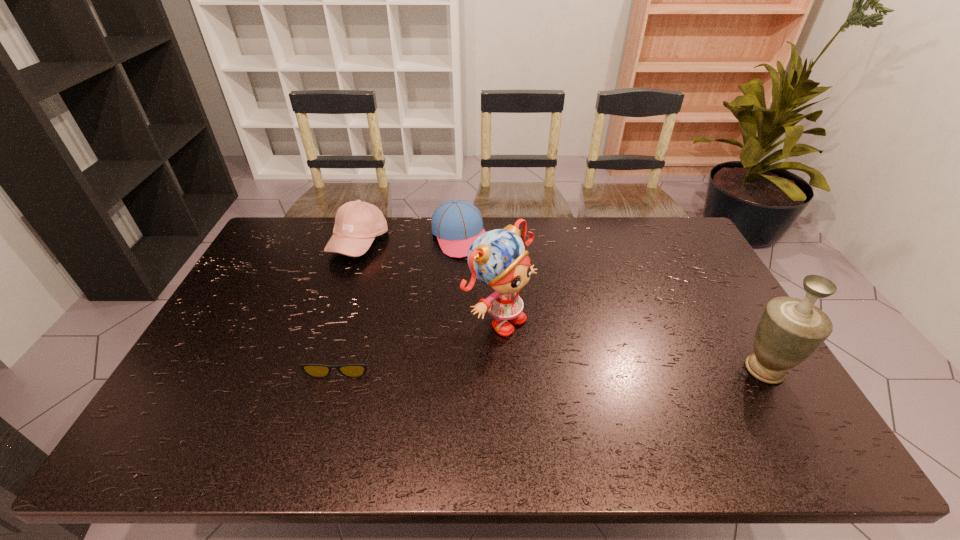
In the image, there is a desktop. Where is `vacant space at the far edge`? The image size is (960, 540). vacant space at the far edge is located at coordinates [551, 224].

Where is `free location at the near edge`? The image size is (960, 540). free location at the near edge is located at coordinates (401, 393).

What are the coordinates of `free space at the left edge of the desktop` in the screenshot? It's located at (259, 298).

Find the location of a particular element. The width and height of the screenshot is (960, 540). vacant space at the right edge of the desktop is located at coordinates (700, 297).

The height and width of the screenshot is (540, 960). In the image, there is a desktop. Find the location of `vacant space at the far left corner`. vacant space at the far left corner is located at coordinates (287, 230).

Image resolution: width=960 pixels, height=540 pixels. I want to click on vacant space at the near right corner, so click(x=734, y=401).

Where is `free point between the shorter baseball cap and the left baseball cap`? The image size is (960, 540). free point between the shorter baseball cap and the left baseball cap is located at coordinates (410, 240).

Locate an element on the screen. The height and width of the screenshot is (540, 960). blank region between the left baseball cap and the second shortest object is located at coordinates (410, 240).

At what (x,y) coordinates should I click in order to perform the action: click on vacant region between the fourth tallest object and the rightmost object. Please return your answer as a coordinate pair (x, y). The image size is (960, 540). Looking at the image, I should click on (612, 303).

I want to click on vacant region between the left baseball cap and the doll, so click(x=429, y=281).